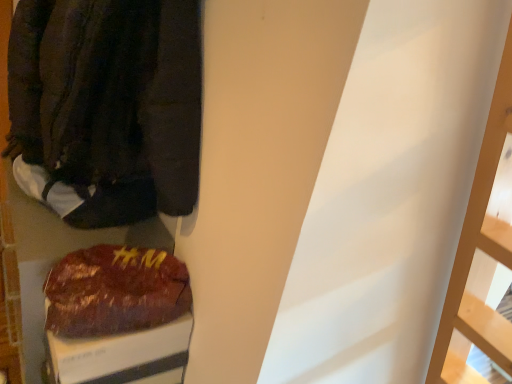
Question: Is dark brown fabric jacket at left touching shiny brown bag at lower left?

Choices:
 (A) no
 (B) yes

Answer: (A)

Question: Can you confirm if dark brown fabric jacket at left is wider than shiny brown bag at lower left?

Choices:
 (A) yes
 (B) no

Answer: (A)

Question: Considering the relative sizes of dark brown fabric jacket at left and shiny brown bag at lower left in the image provided, is dark brown fabric jacket at left bigger than shiny brown bag at lower left?

Choices:
 (A) no
 (B) yes

Answer: (B)

Question: Can you confirm if dark brown fabric jacket at left is smaller than shiny brown bag at lower left?

Choices:
 (A) yes
 (B) no

Answer: (B)

Question: From a real-world perspective, is dark brown fabric jacket at left on top of shiny brown bag at lower left?

Choices:
 (A) no
 (B) yes

Answer: (B)

Question: Would you say dark brown fabric jacket at left is a long distance from shiny brown bag at lower left?

Choices:
 (A) yes
 (B) no

Answer: (B)

Question: Is shiny brown bag at lower left thinner than dark brown fabric jacket at left?

Choices:
 (A) yes
 (B) no

Answer: (A)

Question: Considering the relative sizes of shiny brown bag at lower left and dark brown fabric jacket at left in the image provided, is shiny brown bag at lower left bigger than dark brown fabric jacket at left?

Choices:
 (A) no
 (B) yes

Answer: (A)

Question: Does shiny brown bag at lower left touch dark brown fabric jacket at left?

Choices:
 (A) yes
 (B) no

Answer: (B)

Question: Can you confirm if shiny brown bag at lower left is smaller than dark brown fabric jacket at left?

Choices:
 (A) no
 (B) yes

Answer: (B)

Question: Considering the relative positions of shiny brown bag at lower left and dark brown fabric jacket at left in the image provided, is shiny brown bag at lower left to the right of dark brown fabric jacket at left from the viewer's perspective?

Choices:
 (A) yes
 (B) no

Answer: (B)

Question: From the image's perspective, is shiny brown bag at lower left on dark brown fabric jacket at left?

Choices:
 (A) no
 (B) yes

Answer: (A)

Question: From a real-world perspective, is shiny brown bag at lower left positioned under white fabric shoe at left based on gravity?

Choices:
 (A) no
 (B) yes

Answer: (B)